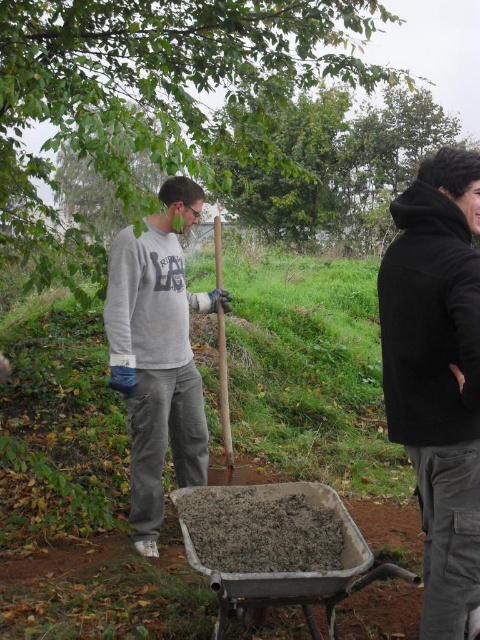
Question: Which point is farther from the camera taking this photo?

Choices:
 (A) (220, 538)
 (B) (222, 394)
 (C) (440, 467)
 (D) (122, 196)

Answer: (B)

Question: In this image, where is green leafy tree at upper left located relative to wooden shovel at center?

Choices:
 (A) right
 (B) left

Answer: (B)

Question: Which point is farther from the camera taking this photo?

Choices:
 (A) (17, 202)
 (B) (192, 520)

Answer: (A)

Question: Does green leafy tree at upper left appear on the right side of gray cotton sweatshirt at center?

Choices:
 (A) yes
 (B) no

Answer: (B)

Question: Based on their relative distances, which object is nearer to the gray concrete cart at center?

Choices:
 (A) wooden shovel at center
 (B) gray cotton sweatshirt at center
 (C) black fleece jacket at right

Answer: (C)

Question: Is green leafy tree at upper left thinner than black fleece jacket at right?

Choices:
 (A) yes
 (B) no

Answer: (B)